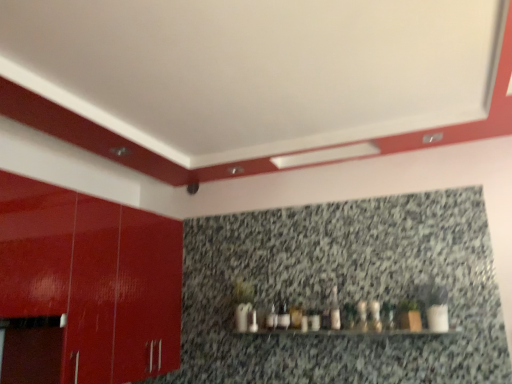
Question: Does white glossy bottle at center, arranged as the first bottle when viewed from the left, touch glossy red cabinet at left?

Choices:
 (A) yes
 (B) no

Answer: (B)

Question: Can you confirm if white glossy bottle at center, the 3th bottle viewed from the right, is taller than glossy red cabinet at left?

Choices:
 (A) yes
 (B) no

Answer: (B)

Question: Is white glossy bottle at center, arranged as the first bottle when viewed from the left, facing away from glossy red cabinet at left?

Choices:
 (A) yes
 (B) no

Answer: (B)

Question: Is white glossy bottle at center, arranged as the first bottle when viewed from the left, further to the viewer compared to glossy red cabinet at left?

Choices:
 (A) yes
 (B) no

Answer: (A)

Question: From a real-world perspective, is white glossy bottle at center, arranged as the first bottle when viewed from the left, located beneath glossy red cabinet at left?

Choices:
 (A) yes
 (B) no

Answer: (A)

Question: Looking at the image, does glossy red cabinet at left seem bigger or smaller compared to white glossy bottle at center, which ranks as the 1th bottle in right-to-left order?

Choices:
 (A) big
 (B) small

Answer: (A)

Question: Considering the positions of point (96, 336) and point (377, 327), is point (96, 336) closer or farther from the camera than point (377, 327)?

Choices:
 (A) farther
 (B) closer

Answer: (B)

Question: Looking at their shapes, would you say glossy red cabinet at left is wider or thinner than white glossy bottle at center, the third bottle when ordered from left to right?

Choices:
 (A) wide
 (B) thin

Answer: (A)

Question: Based on their positions, is glossy red cabinet at left located to the left or right of white glossy bottle at center, the third bottle when ordered from left to right?

Choices:
 (A) left
 (B) right

Answer: (A)

Question: Is matte white bottle at center, the second bottle from the left, situated inside white glossy bottle at center, the third bottle when ordered from left to right, or outside?

Choices:
 (A) inside
 (B) outside

Answer: (B)

Question: In terms of size, does matte white bottle at center, placed as the second bottle when sorted from right to left, appear bigger or smaller than white glossy bottle at center, which ranks as the 1th bottle in right-to-left order?

Choices:
 (A) big
 (B) small

Answer: (A)

Question: In the image, is matte white bottle at center, placed as the second bottle when sorted from right to left, positioned in front of or behind white glossy bottle at center, which ranks as the 1th bottle in right-to-left order?

Choices:
 (A) behind
 (B) front

Answer: (A)

Question: From a real-world perspective, relative to white glossy bottle at center, which ranks as the 1th bottle in right-to-left order, is matte white bottle at center, placed as the second bottle when sorted from right to left, vertically above or below?

Choices:
 (A) below
 (B) above

Answer: (B)

Question: In terms of width, does granite at upper center look wider or thinner when compared to white glossy bottle at center, arranged as the first bottle when viewed from the left?

Choices:
 (A) wide
 (B) thin

Answer: (B)

Question: From a real-world perspective, is granite at upper center physically located above or below white glossy bottle at center, arranged as the first bottle when viewed from the left?

Choices:
 (A) above
 (B) below

Answer: (A)